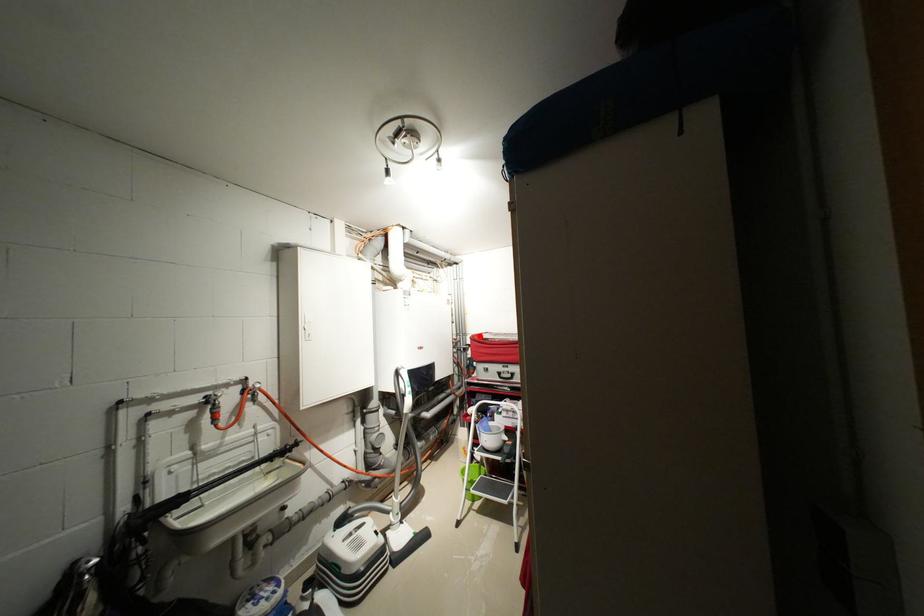
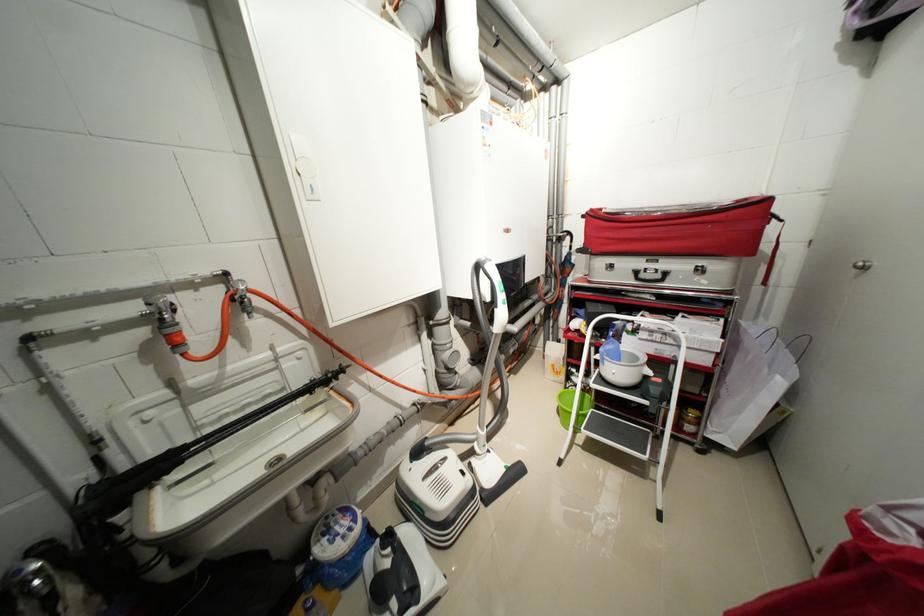
Question: A red point is marked in image1. In image2, is the corresponding 3D point closer to the camera or farther? Reply with the corresponding letter.

Choices:
 (A) The corresponding 3D point is closer.
 (B) The corresponding 3D point is farther.

Answer: (A)